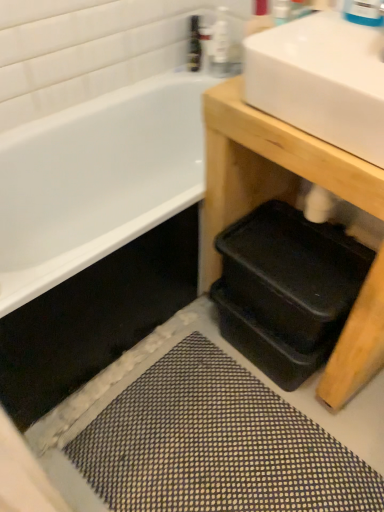
Locate an element on the screen. free space above textured gray bath mat at lower center (from a real-world perspective) is located at coordinates (219, 429).